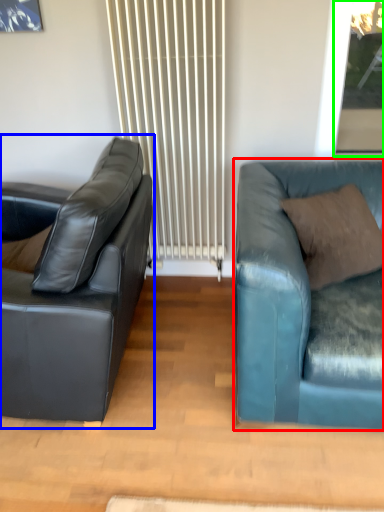
Question: Based on their relative distances, which object is nearer to studio couch (highlighted by a red box)? Choose from studio couch (highlighted by a blue box) and window screen (highlighted by a green box).

Choices:
 (A) studio couch
 (B) window screen

Answer: (A)